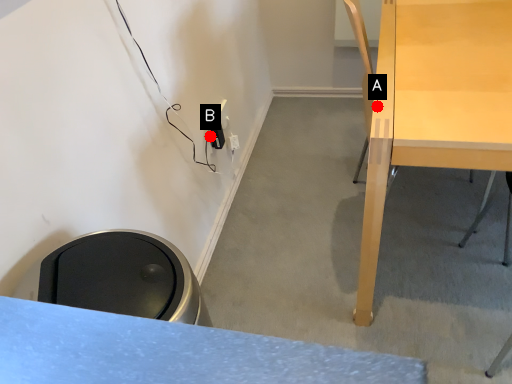
Question: Two points are circled on the image, labeled by A and B beside each circle. Which of the following is the closest to the observer?

Choices:
 (A) A is closer
 (B) B is closer

Answer: (A)